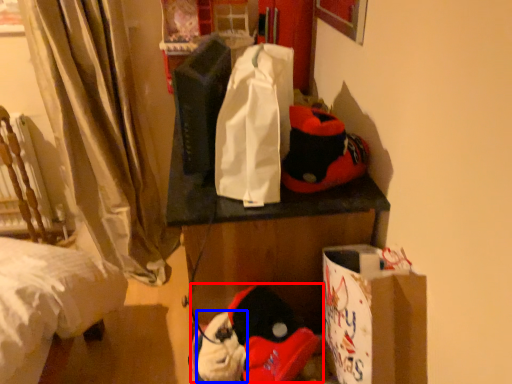
Question: Which of the following is the farthest to the observer, toy (highlighted by a red box) or toy (highlighted by a blue box)?

Choices:
 (A) toy
 (B) toy

Answer: (B)